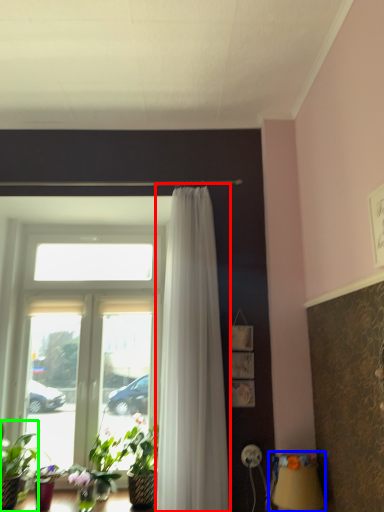
Question: Considering the real-world distances, which object is closest to curtain (highlighted by a red box)? table lamp (highlighted by a blue box) or houseplant (highlighted by a green box).

Choices:
 (A) table lamp
 (B) houseplant

Answer: (A)